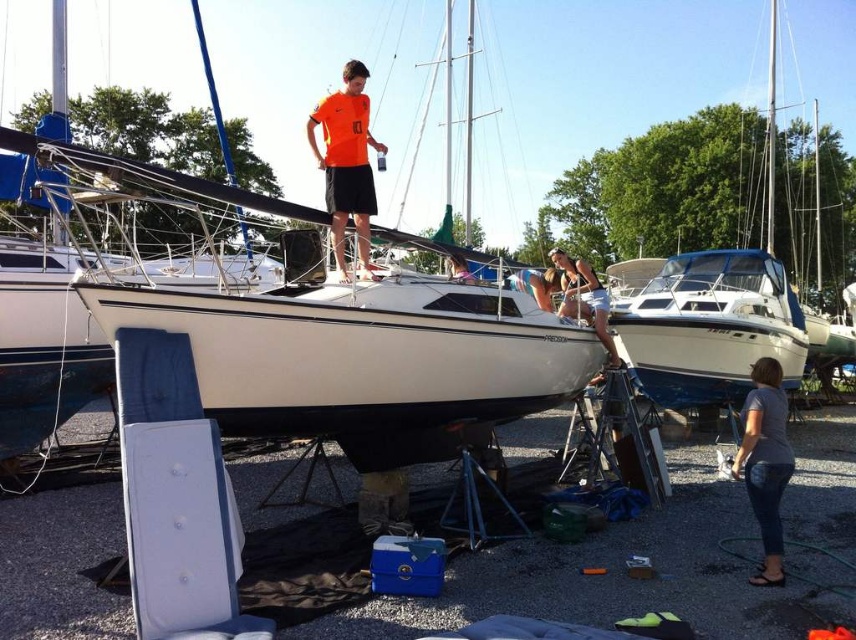
Between orange matte shirt at center and matte white tank top at center, which one is positioned lower?

Positioned lower is matte white tank top at center.

Can you confirm if orange matte shirt at center is shorter than matte white tank top at center?

No.

Does point (330, 141) lie in front of point (568, 260)?

Yes.

The image size is (856, 640). I want to click on orange matte shirt at center, so click(x=346, y=163).

Is point (770, 556) more distant than point (566, 305)?

No, it is in front of (566, 305).

Which is above, gray cotton shirt at lower right or matte white tank top at center?

matte white tank top at center is higher up.

At what (x,y) coordinates should I click in order to perform the action: click on gray cotton shirt at lower right. Please return your answer as a coordinate pair (x, y). This screenshot has height=640, width=856. Looking at the image, I should click on (765, 461).

Is white glossy boat at center positioned at the back of orange matte shirt at center?

That is True.

At what (x,y) coordinates should I click in order to perform the action: click on white glossy boat at center. Please return your answer as a coordinate pair (x, y). This screenshot has width=856, height=640. Looking at the image, I should click on (709, 326).